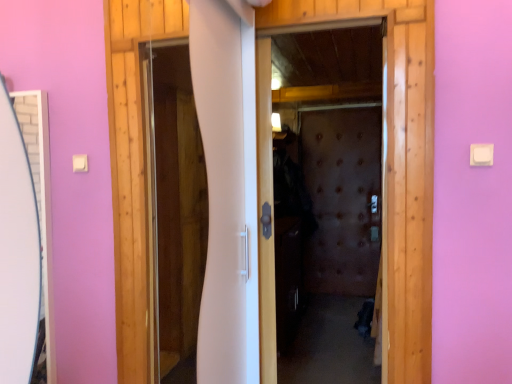
Describe the element at coordinates (208, 201) in the screenshot. I see `white glossy screen door at center, the first screen door viewed from the front` at that location.

Identify the location of white glossy screen door at center, the first screen door viewed from the front. (208, 201).

You are a GUI agent. You are given a task and a screenshot of the screen. Output one action in this format:
    pyautogui.click(x=<x>, y=<y>)
    Task: Click on the brown textured screen door at center, the 2th screen door from the left
    The width and height of the screenshot is (512, 384).
    Given the screenshot: What is the action you would take?
    pyautogui.click(x=342, y=199)

What do you see at coordinates (342, 199) in the screenshot? The image size is (512, 384). I see `brown textured screen door at center, placed as the first screen door when sorted from back to front` at bounding box center [342, 199].

Where is `white glossy screen door at center, the first screen door viewed from the front`? The width and height of the screenshot is (512, 384). white glossy screen door at center, the first screen door viewed from the front is located at coordinates (208, 201).

Looking at this image, between white glossy screen door at center, placed as the second screen door when sorted from back to front, and brown textured screen door at center, placed as the second screen door when sorted from front to back, which one appears on the left side from the viewer's perspective?

white glossy screen door at center, placed as the second screen door when sorted from back to front.

Is white glossy screen door at center, placed as the second screen door when sorted from back to front, positioned behind brown textured screen door at center, the first screen door viewed from the right?

No, white glossy screen door at center, placed as the second screen door when sorted from back to front, is closer to the camera.

Considering the positions of points (214, 169) and (325, 270), is point (214, 169) farther from camera compared to point (325, 270)?

That is False.

From the image's perspective, between white glossy screen door at center, placed as the second screen door when sorted from back to front, and brown textured screen door at center, placed as the second screen door when sorted from front to back, which one is located above?

white glossy screen door at center, placed as the second screen door when sorted from back to front, from the image's perspective.

From a real-world perspective, which is physically above, white glossy screen door at center, the first screen door viewed from the front, or brown textured screen door at center, the 2th screen door from the left?

white glossy screen door at center, the first screen door viewed from the front, from a real-world perspective.

Can you confirm if white glossy screen door at center, the first screen door viewed from the front, is wider than brown textured screen door at center, placed as the second screen door when sorted from front to back?

Incorrect, the width of white glossy screen door at center, the first screen door viewed from the front, does not surpass that of brown textured screen door at center, placed as the second screen door when sorted from front to back.

Considering the sizes of objects white glossy screen door at center, the first screen door viewed from the front, and brown textured screen door at center, the first screen door viewed from the right, in the image provided, who is taller, white glossy screen door at center, the first screen door viewed from the front, or brown textured screen door at center, the first screen door viewed from the right,?

Standing taller between the two is brown textured screen door at center, the first screen door viewed from the right.

Which of these two, white glossy screen door at center, the 2th screen door from the right, or brown textured screen door at center, the first screen door viewed from the right, is smaller?

white glossy screen door at center, the 2th screen door from the right.

Choose the correct answer: Is white glossy screen door at center, the 2th screen door from the right, inside brown textured screen door at center, placed as the first screen door when sorted from back to front, or outside it?

white glossy screen door at center, the 2th screen door from the right, is not inside brown textured screen door at center, placed as the first screen door when sorted from back to front, it's outside.

Are white glossy screen door at center, placed as the second screen door when sorted from back to front, and brown textured screen door at center, the first screen door viewed from the right, located far from each other?

Yes, white glossy screen door at center, placed as the second screen door when sorted from back to front, and brown textured screen door at center, the first screen door viewed from the right, are located far from each other.

Is white glossy screen door at center, which is counted as the first screen door, starting from the left, oriented away from brown textured screen door at center, placed as the second screen door when sorted from front to back?

Correct, white glossy screen door at center, which is counted as the first screen door, starting from the left, is looking away from brown textured screen door at center, placed as the second screen door when sorted from front to back.

How much distance is there between white glossy screen door at center, the 2th screen door from the right, and brown textured screen door at center, the 2th screen door from the left?

The distance of white glossy screen door at center, the 2th screen door from the right, from brown textured screen door at center, the 2th screen door from the left, is 6.59 feet.

Where is `screen door behind the white glossy screen door at center, the 2th screen door from the right`? The image size is (512, 384). screen door behind the white glossy screen door at center, the 2th screen door from the right is located at coordinates (342, 199).

Does brown textured screen door at center, placed as the second screen door when sorted from front to back, appear on the left side of white glossy screen door at center, the 2th screen door from the right?

No.

From the picture: Is brown textured screen door at center, placed as the first screen door when sorted from back to front, positioned behind white glossy screen door at center, the 2th screen door from the right?

Yes, brown textured screen door at center, placed as the first screen door when sorted from back to front, is further from the viewer.

Considering the points (307, 249) and (251, 82), which point is behind, point (307, 249) or point (251, 82)?

Point (307, 249)

From the image's perspective, is brown textured screen door at center, the 2th screen door from the left, below white glossy screen door at center, the first screen door viewed from the front?

Indeed, from the image's perspective, brown textured screen door at center, the 2th screen door from the left, is shown beneath white glossy screen door at center, the first screen door viewed from the front.

From a real-world perspective, which object rests below the other?

brown textured screen door at center, placed as the second screen door when sorted from front to back, from a real-world perspective.

Is brown textured screen door at center, placed as the first screen door when sorted from back to front, wider or thinner than white glossy screen door at center, the 2th screen door from the right?

brown textured screen door at center, placed as the first screen door when sorted from back to front, is wider than white glossy screen door at center, the 2th screen door from the right.

Which of these two, brown textured screen door at center, the first screen door viewed from the right, or white glossy screen door at center, the first screen door viewed from the front, stands taller?

brown textured screen door at center, the first screen door viewed from the right.

Considering the sizes of objects brown textured screen door at center, placed as the first screen door when sorted from back to front, and white glossy screen door at center, placed as the second screen door when sorted from back to front, in the image provided, who is bigger, brown textured screen door at center, placed as the first screen door when sorted from back to front, or white glossy screen door at center, placed as the second screen door when sorted from back to front,?

brown textured screen door at center, placed as the first screen door when sorted from back to front, is bigger.

Is brown textured screen door at center, the 2th screen door from the left, positioned beyond the bounds of white glossy screen door at center, which is counted as the first screen door, starting from the left?

brown textured screen door at center, the 2th screen door from the left, is positioned outside white glossy screen door at center, which is counted as the first screen door, starting from the left.

Are brown textured screen door at center, placed as the second screen door when sorted from front to back, and white glossy screen door at center, the first screen door viewed from the front, far apart?

Absolutely, brown textured screen door at center, placed as the second screen door when sorted from front to back, is distant from white glossy screen door at center, the first screen door viewed from the front.

Is brown textured screen door at center, placed as the second screen door when sorted from front to back, facing away from white glossy screen door at center, the first screen door viewed from the front?

That's not correct — brown textured screen door at center, placed as the second screen door when sorted from front to back, is not looking away from white glossy screen door at center, the first screen door viewed from the front.

How different are the orientations of brown textured screen door at center, the first screen door viewed from the right, and white glossy screen door at center, placed as the second screen door when sorted from back to front, in degrees?

1.17 degrees separate the facing orientations of brown textured screen door at center, the first screen door viewed from the right, and white glossy screen door at center, placed as the second screen door when sorted from back to front.

Locate an element on the screen. The height and width of the screenshot is (384, 512). screen door above the brown textured screen door at center, the 2th screen door from the left (from a real-world perspective) is located at coordinates (208, 201).

I want to click on screen door below the white glossy screen door at center, the 2th screen door from the right (from the image's perspective), so click(342, 199).

At what (x,y) coordinates should I click in order to perform the action: click on screen door located in front of the brown textured screen door at center, placed as the second screen door when sorted from front to back. Please return your answer as a coordinate pair (x, y). The image size is (512, 384). Looking at the image, I should click on (208, 201).